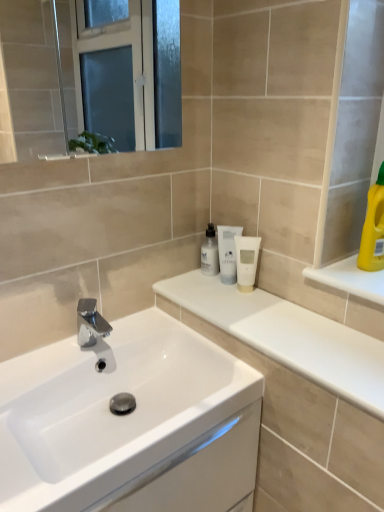
Identify the location of vacant region to the left of transparent plastic bottle at center, the second mouthwash from the right. This screenshot has height=512, width=384. (x=189, y=288).